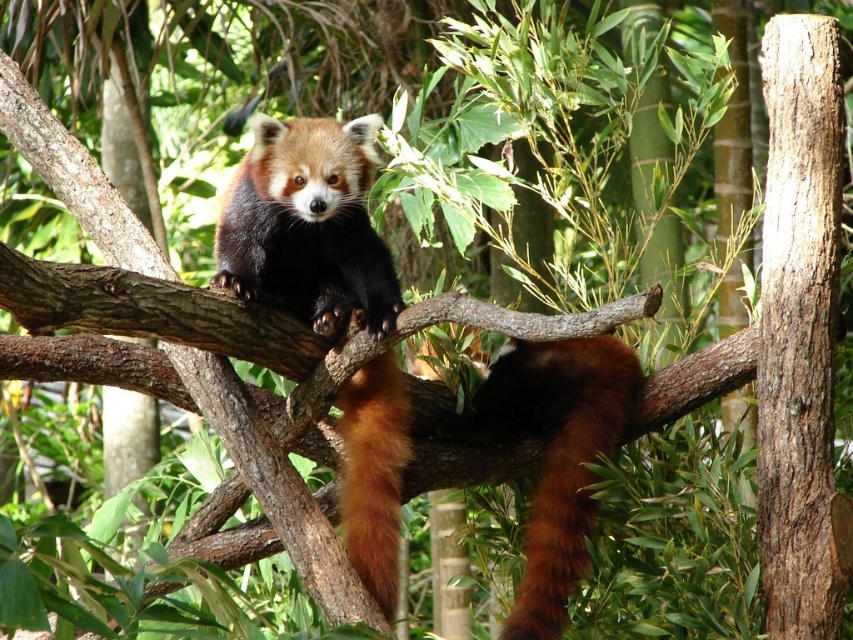
Can you confirm if fluffy brown-red fur at center is positioned above fluffy reddish-brown panda at center?

No, fluffy brown-red fur at center is not above fluffy reddish-brown panda at center.

Which is more to the left, fluffy brown-red fur at center or fluffy reddish-brown panda at center?

From the viewer's perspective, fluffy reddish-brown panda at center appears more on the left side.

In the scene shown: Who is more distant from viewer, (352, 480) or (358, 116)?

The point (358, 116) is more distant.

At what (x,y) coordinates should I click in order to perform the action: click on fluffy brown-red fur at center. Please return your answer as a coordinate pair (x, y). This screenshot has width=853, height=640. Looking at the image, I should click on (306, 225).